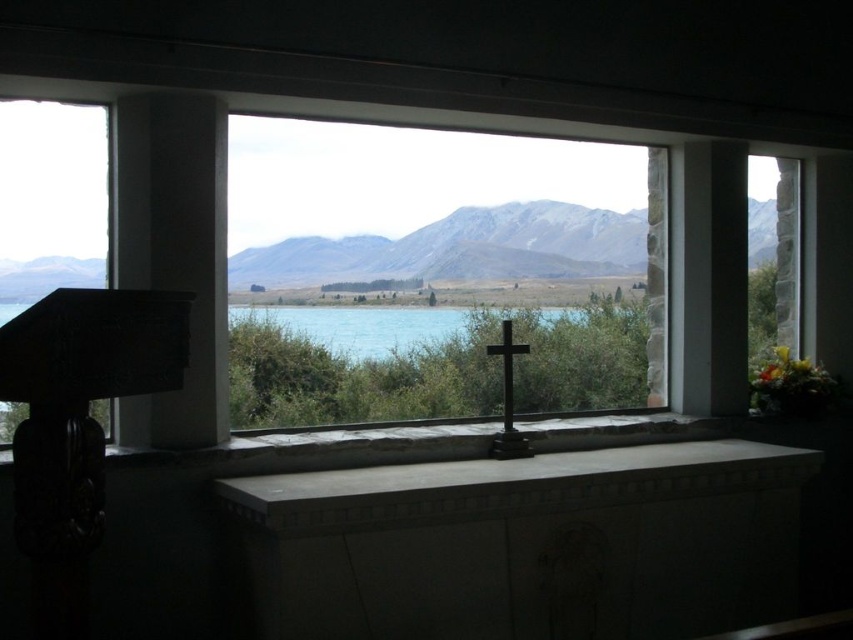
Question: Estimate the real-world distances between objects in this image. Which object is farther from the turquoise water at center?

Choices:
 (A) white marble window sill at center
 (B) transparent glass window at center
 (C) transparent glass window at left

Answer: (C)

Question: Among these objects, which one is nearest to the camera?

Choices:
 (A) turquoise water at center
 (B) transparent glass window at left

Answer: (B)

Question: From the image, what is the correct spatial relationship of transparent glass window at center in relation to transparent glass window at left?

Choices:
 (A) above
 (B) below

Answer: (B)

Question: Which of the following is the closest to the observer?

Choices:
 (A) transparent glass window at left
 (B) turquoise water at center
 (C) transparent glass window at center

Answer: (A)

Question: From the image, what is the correct spatial relationship of transparent glass window at center in relation to turquoise water at center?

Choices:
 (A) right
 (B) left

Answer: (A)

Question: Does white marble window sill at center have a greater width compared to turquoise water at center?

Choices:
 (A) no
 (B) yes

Answer: (B)